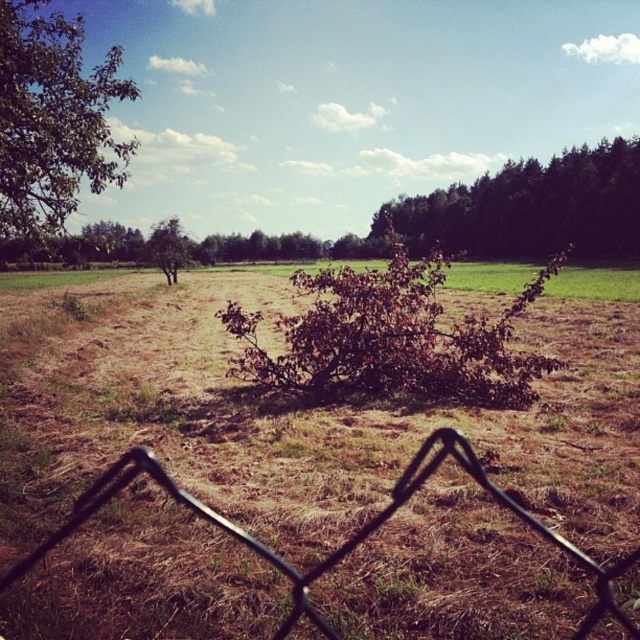
Between brown leafy bush at center and green grass at center, which one has more height?

With more height is brown leafy bush at center.

Between brown leafy bush at center and green grass at center, which one has less height?

Standing shorter between the two is green grass at center.

Identify the location of brown leafy bush at center. Image resolution: width=640 pixels, height=640 pixels. (392, 337).

Image resolution: width=640 pixels, height=640 pixels. I want to click on brown leafy bush at center, so click(392, 337).

Is green leafy tree at upper left positioned in front of green grass at center?

That is True.

The width and height of the screenshot is (640, 640). In order to click on green leafy tree at upper left in this screenshot , I will do `click(52, 120)`.

Find the location of a particular element. This screenshot has height=640, width=640. green leafy tree at upper left is located at coordinates (52, 120).

Does dark green leafy tree at upper right appear under black wire mesh fence at lower center?

Incorrect, dark green leafy tree at upper right is not positioned below black wire mesh fence at lower center.

Is point (460, 243) less distant than point (449, 449)?

No, (460, 243) is behind (449, 449).

In order to click on dark green leafy tree at upper right in this screenshot , I will do `click(529, 208)`.